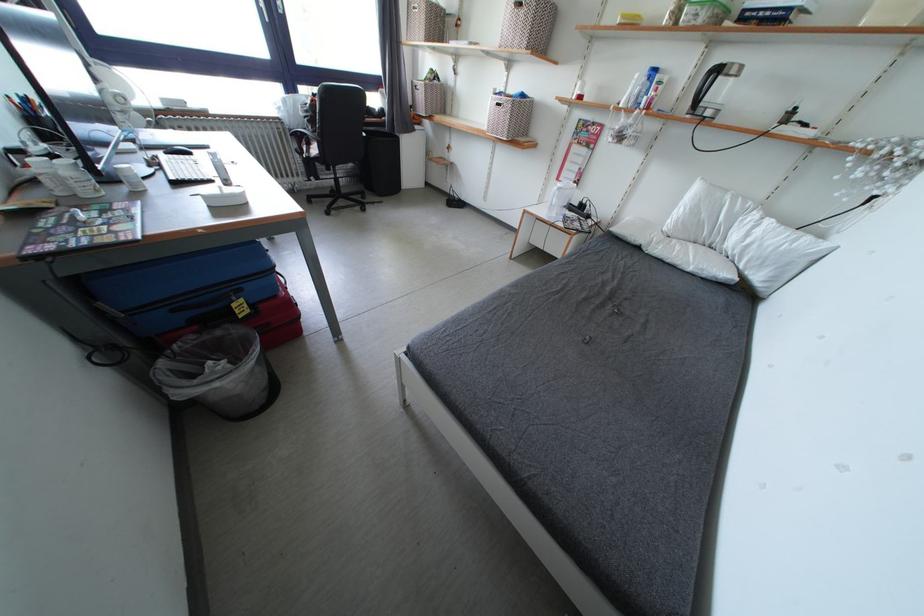
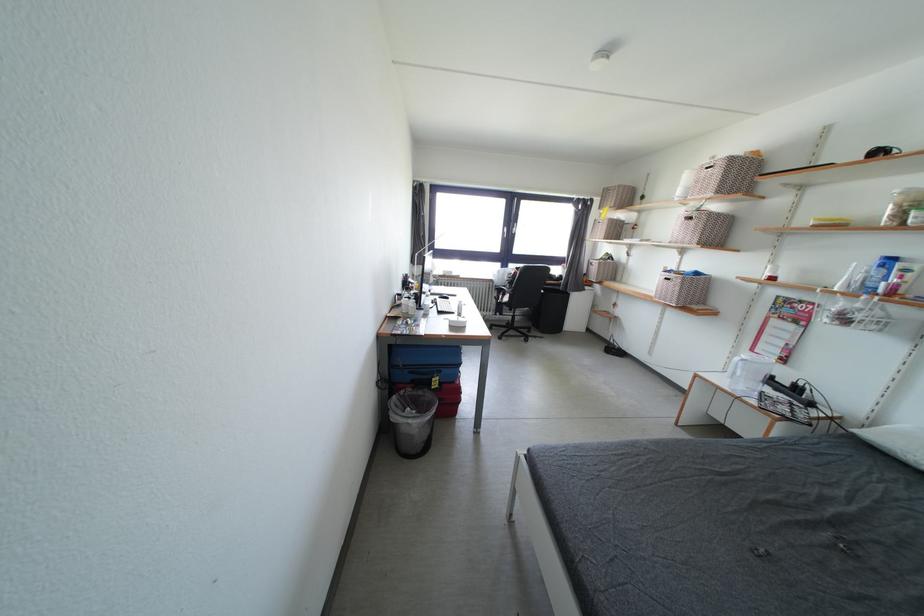
Find the pixel in the second image that matches (x=302, y=95) in the first image.

(514, 270)